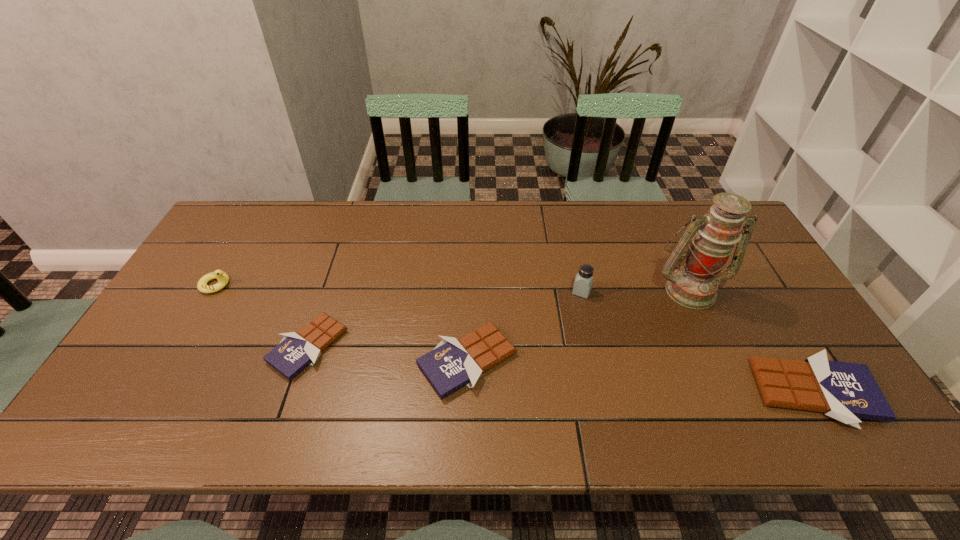
Image resolution: width=960 pixels, height=540 pixels. In order to click on free space between the tallest object and the rightmost chocolate bar in this screenshot , I will do `click(752, 341)`.

Locate an element on the screen. free area in between the leftmost chocolate bar and the tallest object is located at coordinates (498, 318).

This screenshot has width=960, height=540. What are the coordinates of `free spot between the oil lamp and the shortest object` in the screenshot? It's located at (498, 318).

Identify the location of vacant space in between the tallest object and the third tallest object. The image size is (960, 540). (452, 287).

This screenshot has width=960, height=540. Identify the location of unoccupied area between the third tallest object and the third object from left to right. (342, 323).

At what (x,y) coordinates should I click in order to perform the action: click on object that stands as the closest to the duckling. Please return your answer as a coordinate pair (x, y). This screenshot has width=960, height=540. Looking at the image, I should click on (295, 352).

Identify which object is the second nearest to the fifth shortest object. Please provide its 2D coordinates. Your answer should be formatted as a tuple, i.e. [(x, y)], where the tuple contains the x and y coordinates of a point satisfying the conditions above.

[(452, 364)]

Locate which chocolate bar is the second closest to the rightmost chocolate bar. Please provide its 2D coordinates. Your answer should be formatted as a tuple, i.e. [(x, y)], where the tuple contains the x and y coordinates of a point satisfying the conditions above.

[(295, 352)]

Where is `chocolate bar that can be found as the third closest to the leftmost object`? The width and height of the screenshot is (960, 540). chocolate bar that can be found as the third closest to the leftmost object is located at coordinates (845, 391).

At what (x,y) coordinates should I click in order to perform the action: click on free region that satisfies the following two spatial constraints: 1. on the front side of the rightmost chocolate bar; 2. on the left side of the third object from right to left. Please return your answer as a coordinate pair (x, y). The height and width of the screenshot is (540, 960). Looking at the image, I should click on (604, 392).